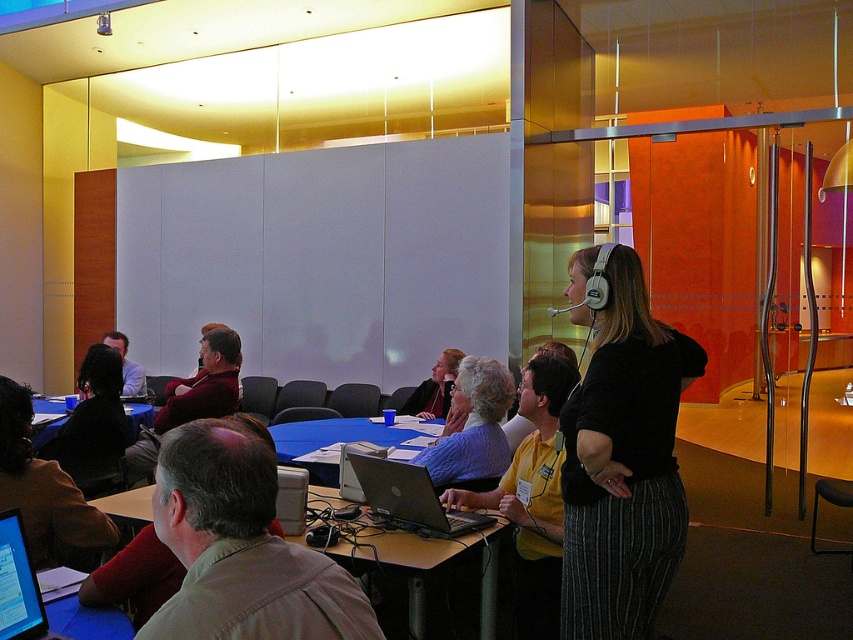
You are organizing a small event in this room and need to place a large poster that requires a surface larger than the matte purple shirt at center. Can the blue plastic table at center accommodate it?

The matte purple shirt at center is bigger than the blue plastic table at center, so the blue plastic table at center may not be able to accommodate the large poster if it is larger than the shirt.

You are a participant in the conference room and want to know the exact location of the light brown shirt at center. Can you describe its position using coordinates?

The light brown shirt at center is located at coordinates point (241, 548).

You are attending a presentation in the conference room and notice the matte purple shirt at center and the blue plastic table at center. Which object is higher in height?

The matte purple shirt at center is taller than the blue plastic table at center.